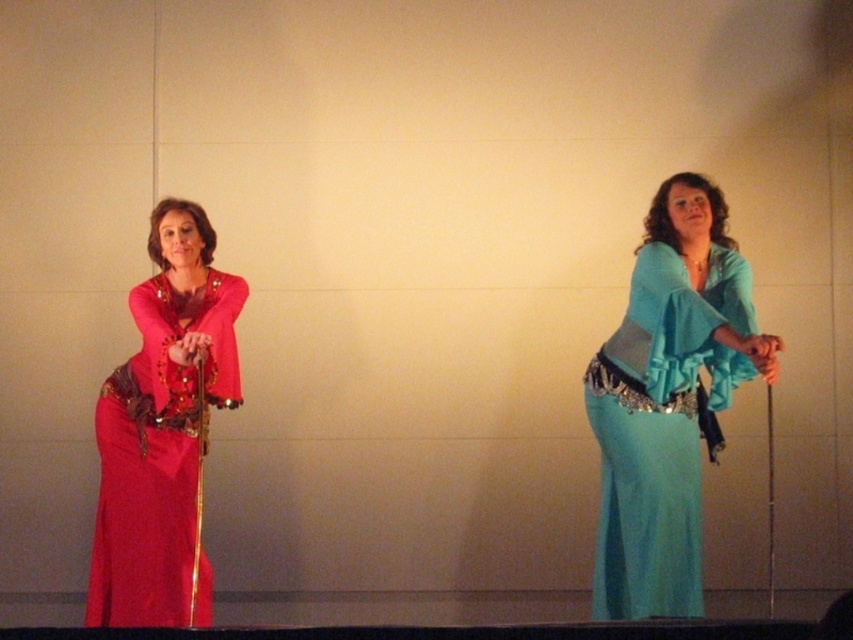
Question: Which point appears closest to the camera in this image?

Choices:
 (A) (671, 342)
 (B) (163, 444)

Answer: (A)

Question: Is teal satin dress at right positioned at the back of matte red dress at left?

Choices:
 (A) yes
 (B) no

Answer: (A)

Question: Can you confirm if teal satin dress at right is wider than matte red dress at left?

Choices:
 (A) no
 (B) yes

Answer: (B)

Question: Does teal satin dress at right appear under matte red dress at left?

Choices:
 (A) yes
 (B) no

Answer: (B)